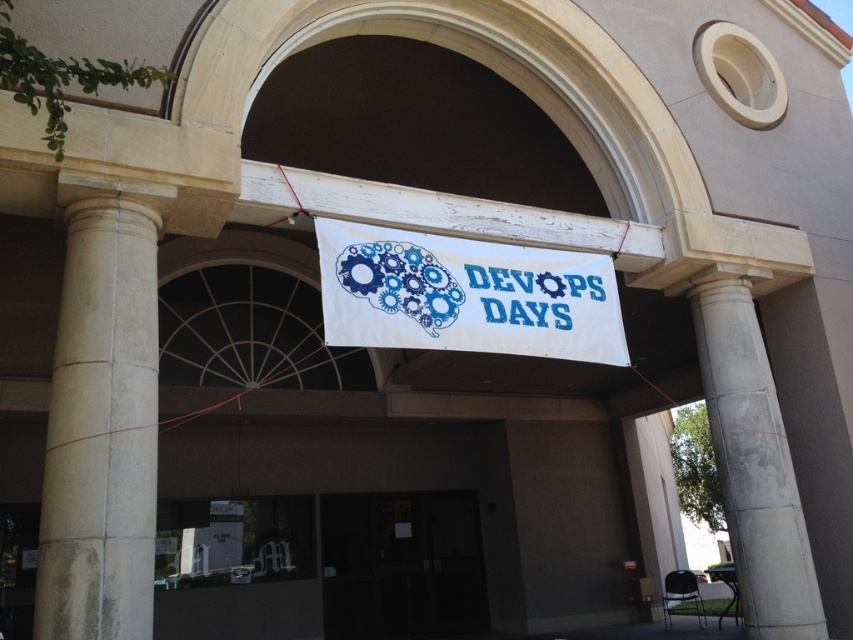
Is white stone column at left to the left of transparent glass door at center from the viewer's perspective?

Yes, white stone column at left is to the left of transparent glass door at center.

Can you confirm if white stone column at left is bigger than transparent glass door at center?

No.

Image resolution: width=853 pixels, height=640 pixels. What do you see at coordinates (102, 419) in the screenshot?
I see `white stone column at left` at bounding box center [102, 419].

Identify the location of white stone column at left. The image size is (853, 640). (102, 419).

This screenshot has height=640, width=853. I want to click on white stone column at left, so click(x=102, y=419).

Can you confirm if white stone column at left is positioned below white fabric banner at center?

Yes, white stone column at left is below white fabric banner at center.

The image size is (853, 640). In order to click on white stone column at left in this screenshot , I will do `click(102, 419)`.

This screenshot has height=640, width=853. What do you see at coordinates (102, 419) in the screenshot? I see `white stone column at left` at bounding box center [102, 419].

Measure the distance between point (155, 241) and camera.

Point (155, 241) and camera are 5.09 meters apart.

The width and height of the screenshot is (853, 640). Find the location of `white stone column at left`. white stone column at left is located at coordinates (102, 419).

The height and width of the screenshot is (640, 853). I want to click on white stone column at left, so click(x=102, y=419).